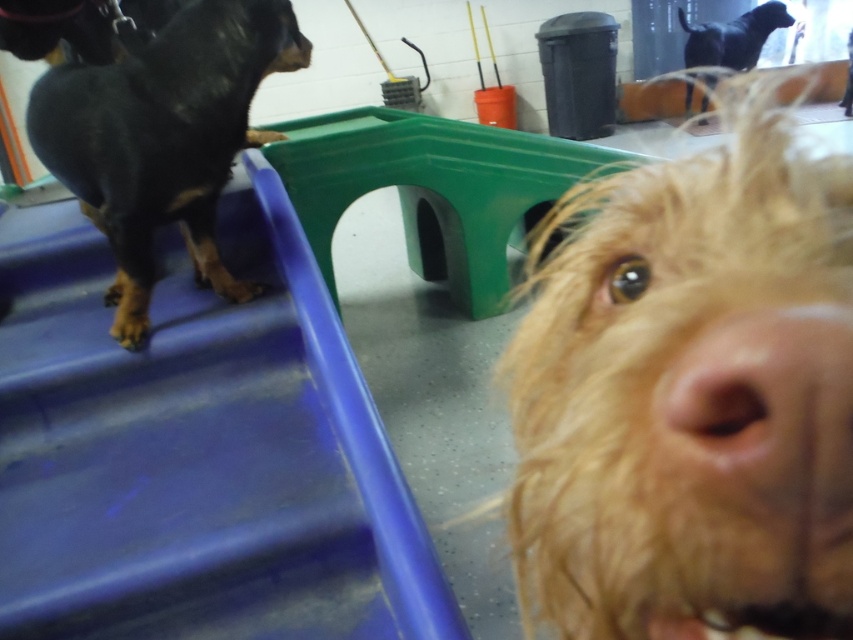
Can you confirm if black smooth dog at left is smaller than black glossy statue at upper right?

Indeed, black smooth dog at left has a smaller size compared to black glossy statue at upper right.

What do you see at coordinates (163, 138) in the screenshot? I see `black smooth dog at left` at bounding box center [163, 138].

Does point (126, 60) come in front of point (744, 29)?

That is True.

The height and width of the screenshot is (640, 853). In order to click on black smooth dog at left in this screenshot , I will do `click(163, 138)`.

Can you confirm if wet golden fur at center is bigger than black smooth dog at left?

No.

Who is more distant from viewer, (583,244) or (137,134)?

The point (137,134) is more distant.

Is point (819, 387) farther from viewer compared to point (199, 10)?

No, it is not.

At what (x,y) coordinates should I click in order to perform the action: click on wet golden fur at center. Please return your answer as a coordinate pair (x, y). Looking at the image, I should click on (689, 394).

Is wet golden fur at center thinner than black glossy statue at upper right?

Correct, wet golden fur at center's width is less than black glossy statue at upper right's.

From the picture: Can you confirm if wet golden fur at center is positioned above black glossy statue at upper right?

No, wet golden fur at center is not above black glossy statue at upper right.

Between point (683, 531) and point (706, 77), which one is positioned in front?

Point (683, 531)

This screenshot has height=640, width=853. Find the location of `wet golden fur at center`. wet golden fur at center is located at coordinates (689, 394).